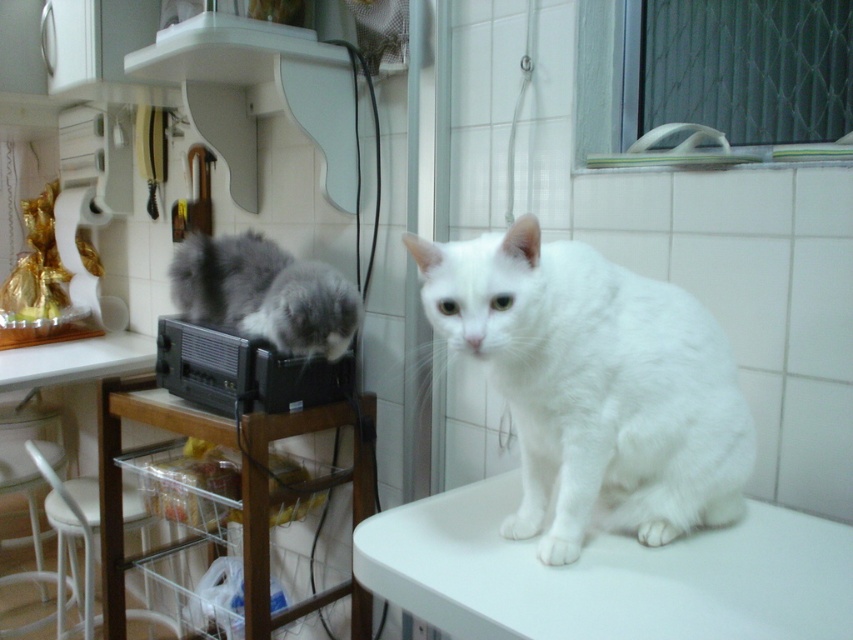
You are a photographer setting up a camera at position point 0.5, 0.5. You want to capture both the white fluffy cat at center and the gray and white cat on the black stereo. Which cat is closer to your camera position?

The white fluffy cat at center is closer to the camera position at point (426, 320) because its coordinates are at (595, 387), which is nearer in comparison to the gray and white cat on the black stereo whose position is not specified but implied to be further away based on the description.

You are a cat owner who wants to place a small toy between the transparent plastic table at lower left and the white plastic table at lower left. Can you fit the toy between them?

The transparent plastic table at lower left is below the white plastic table at lower left, so there is no space between them for the toy to fit.